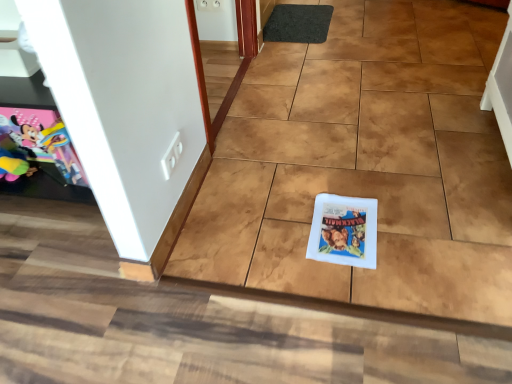
Question: Is matte paper comic book at left, the 2th comic book in the right-to-left sequence, shorter than white paper comic book at center, which is the 1th comic book from bottom to top?

Choices:
 (A) yes
 (B) no

Answer: (B)

Question: From a real-world perspective, is matte paper comic book at left, which is the 1th comic book from top to bottom, below white paper comic book at center, which is the 1th comic book from bottom to top?

Choices:
 (A) no
 (B) yes

Answer: (A)

Question: From a real-world perspective, is matte paper comic book at left, the 2th comic book in the right-to-left sequence, over white paper comic book at center, acting as the second comic book starting from the left?

Choices:
 (A) no
 (B) yes

Answer: (B)

Question: Would you say matte paper comic book at left, which ranks as the second comic book in bottom-to-top order, is a long distance from white paper comic book at center, which is the 1th comic book in right-to-left order?

Choices:
 (A) no
 (B) yes

Answer: (A)

Question: Is matte paper comic book at left, which is the 1th comic book from top to bottom, smaller than white paper comic book at center, which is the 1th comic book in right-to-left order?

Choices:
 (A) no
 (B) yes

Answer: (A)

Question: Could you tell me if matte paper comic book at left, which appears as the 1th comic book when viewed from the left, is turned towards white paper comic book at center, acting as the second comic book starting from the left?

Choices:
 (A) yes
 (B) no

Answer: (B)

Question: Does black rubber doormat at upper center have a greater width compared to matte paper comic book at left, which ranks as the second comic book in bottom-to-top order?

Choices:
 (A) no
 (B) yes

Answer: (B)

Question: Considering the relative sizes of black rubber doormat at upper center and matte paper comic book at left, which ranks as the second comic book in bottom-to-top order, in the image provided, is black rubber doormat at upper center taller than matte paper comic book at left, which ranks as the second comic book in bottom-to-top order,?

Choices:
 (A) no
 (B) yes

Answer: (A)

Question: Can matte paper comic book at left, which ranks as the second comic book in bottom-to-top order, be found inside black rubber doormat at upper center?

Choices:
 (A) yes
 (B) no

Answer: (B)

Question: From the image's perspective, would you say black rubber doormat at upper center is shown under matte paper comic book at left, which appears as the 1th comic book when viewed from the left?

Choices:
 (A) yes
 (B) no

Answer: (B)

Question: Is black rubber doormat at upper center shorter than matte paper comic book at left, the 2th comic book in the right-to-left sequence?

Choices:
 (A) yes
 (B) no

Answer: (A)

Question: Is black rubber doormat at upper center far from matte paper comic book at left, which is the 1th comic book from top to bottom?

Choices:
 (A) no
 (B) yes

Answer: (B)

Question: From the image's perspective, is black rubber doormat at upper center located above white paper comic book at center, which is the 1th comic book from bottom to top?

Choices:
 (A) yes
 (B) no

Answer: (A)